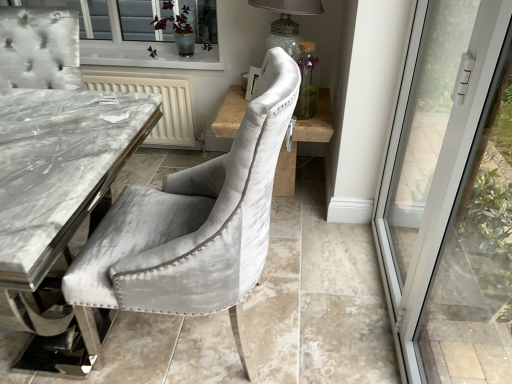
Question: Is velvet chair at center closer to the viewer compared to purple velvet plant at upper center?

Choices:
 (A) no
 (B) yes

Answer: (B)

Question: Is velvet chair at center at the right side of purple velvet plant at upper center?

Choices:
 (A) yes
 (B) no

Answer: (B)

Question: Can you confirm if velvet chair at center is thinner than purple velvet plant at upper center?

Choices:
 (A) no
 (B) yes

Answer: (A)

Question: From the image's perspective, would you say velvet chair at center is shown under purple velvet plant at upper center?

Choices:
 (A) yes
 (B) no

Answer: (A)

Question: From a real-world perspective, does velvet chair at center stand above purple velvet plant at upper center?

Choices:
 (A) yes
 (B) no

Answer: (B)

Question: In the image, is velvet chair at center positioned in front of or behind transparent glass door at right?

Choices:
 (A) behind
 (B) front

Answer: (A)

Question: Looking at the image, does velvet chair at center seem bigger or smaller compared to transparent glass door at right?

Choices:
 (A) big
 (B) small

Answer: (A)

Question: In the image, is velvet chair at center on the left side or the right side of transparent glass door at right?

Choices:
 (A) right
 (B) left

Answer: (B)

Question: Considering the positions of point (262, 327) and point (401, 125), is point (262, 327) closer or farther from the camera than point (401, 125)?

Choices:
 (A) farther
 (B) closer

Answer: (B)

Question: Is point (262, 306) positioned closer to the camera than point (322, 107)?

Choices:
 (A) farther
 (B) closer

Answer: (B)

Question: Is velvet chair at center to the left or to the right of light brown wood side table at center in the image?

Choices:
 (A) right
 (B) left

Answer: (B)

Question: In terms of size, does velvet chair at center appear bigger or smaller than light brown wood side table at center?

Choices:
 (A) big
 (B) small

Answer: (A)

Question: From a real-world perspective, is velvet chair at center positioned above or below light brown wood side table at center?

Choices:
 (A) above
 (B) below

Answer: (B)

Question: From their relative heights in the image, would you say velvet chair at center is taller or shorter than velvet grey chair at center?

Choices:
 (A) short
 (B) tall

Answer: (A)

Question: From a real-world perspective, relative to velvet grey chair at center, is velvet chair at center vertically above or below?

Choices:
 (A) below
 (B) above

Answer: (A)